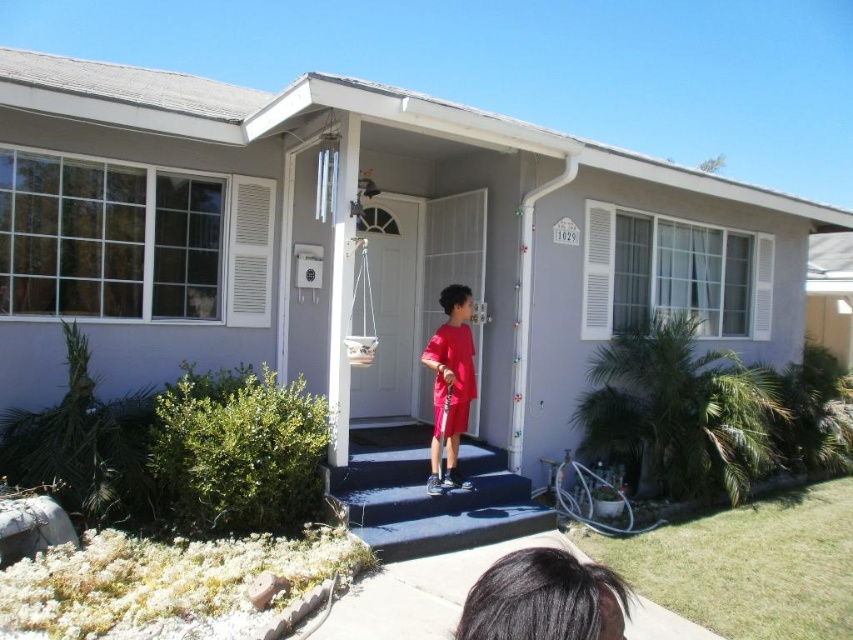
Question: Can you confirm if smooth concrete steps at center is thinner than matte red shorts at center?

Choices:
 (A) no
 (B) yes

Answer: (A)

Question: Which of the following is the farthest from the observer?

Choices:
 (A) (430, 356)
 (B) (396, 496)

Answer: (A)

Question: Which point is farther from the camera taking this photo?

Choices:
 (A) (430, 448)
 (B) (379, 468)

Answer: (A)

Question: Can you confirm if smooth concrete steps at center is wider than matte red shorts at center?

Choices:
 (A) no
 (B) yes

Answer: (B)

Question: Can you confirm if smooth concrete steps at center is positioned above matte red shorts at center?

Choices:
 (A) no
 (B) yes

Answer: (A)